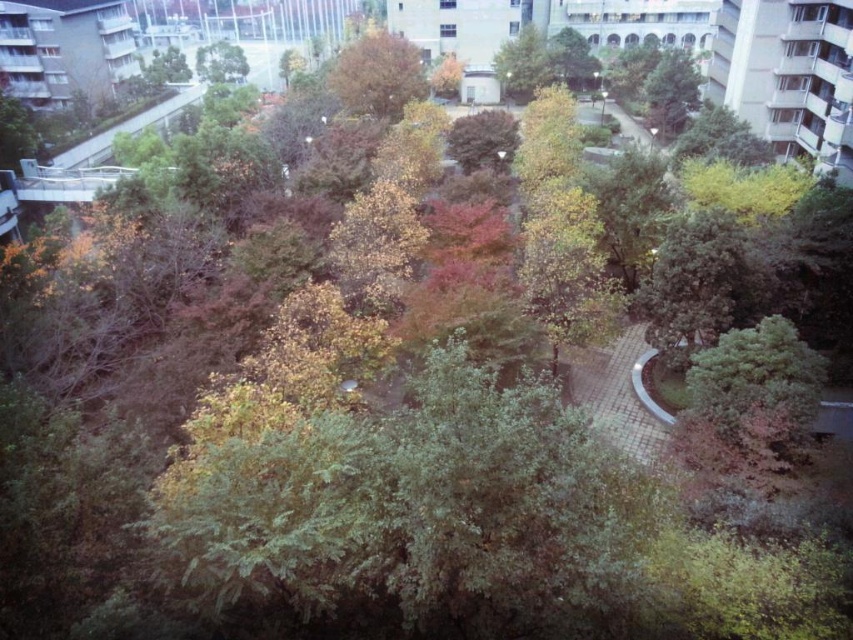
Question: Which object appears farthest from the camera in this image?

Choices:
 (A) green leafy tree at upper center
 (B) brown textured tree at center

Answer: (A)

Question: Is brown textured tree at center closer to the viewer compared to green leafy tree at upper center?

Choices:
 (A) no
 (B) yes

Answer: (B)

Question: Is brown textured tree at center positioned in front of green leafy tree at upper center?

Choices:
 (A) yes
 (B) no

Answer: (A)

Question: Can you confirm if brown textured tree at center is thinner than green leafy tree at upper center?

Choices:
 (A) yes
 (B) no

Answer: (B)

Question: Which point is farther to the camera?

Choices:
 (A) (416, 93)
 (B) (224, 68)

Answer: (B)